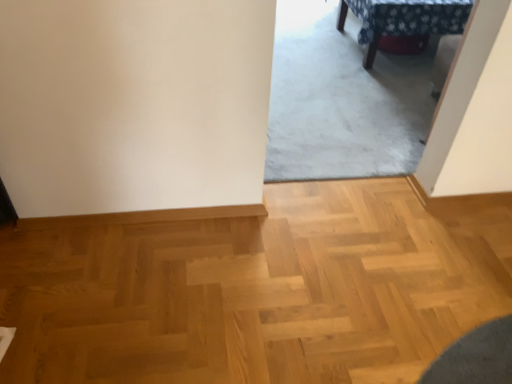
Question: Should I look upward or downward to see patterned fabric table at upper right?

Choices:
 (A) down
 (B) up

Answer: (B)